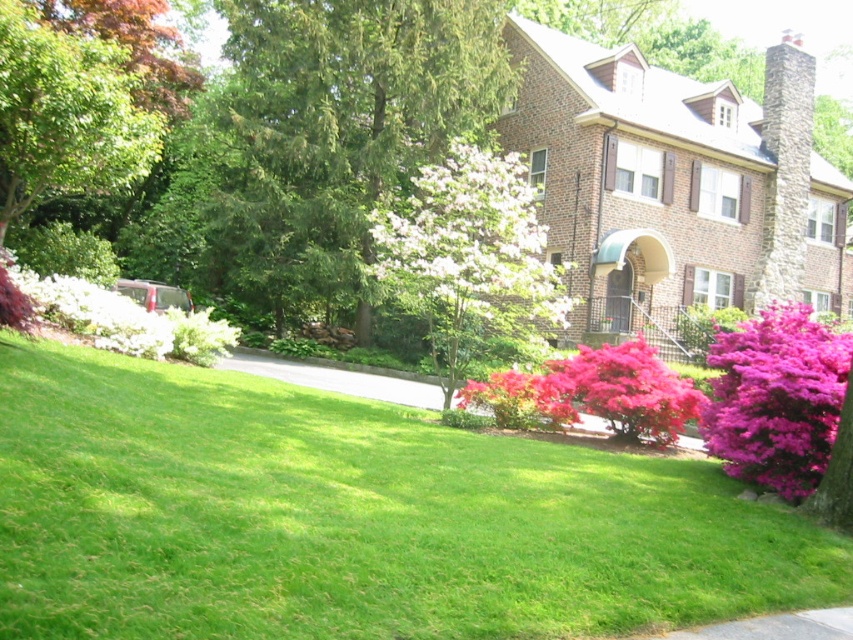
Question: In this image, where is pink glossy bush at lower right located relative to gray asphalt pavement at center?

Choices:
 (A) right
 (B) left

Answer: (A)

Question: Which point is farther to the camera?

Choices:
 (A) (234, 38)
 (B) (514, 301)
 (C) (4, 160)

Answer: (A)

Question: Does white matte flower at center have a larger size compared to pink glossy bush at lower right?

Choices:
 (A) no
 (B) yes

Answer: (B)

Question: Among these objects, which one is farthest from the camera?

Choices:
 (A) gray asphalt pavement at center
 (B) white matte flower at center

Answer: (A)

Question: Which object appears closest to the camera in this image?

Choices:
 (A) white matte flower at center
 (B) green leafy tree at upper left

Answer: (A)

Question: Is purple velvet bush at lower right to the left of gray asphalt pavement at center from the viewer's perspective?

Choices:
 (A) yes
 (B) no

Answer: (B)